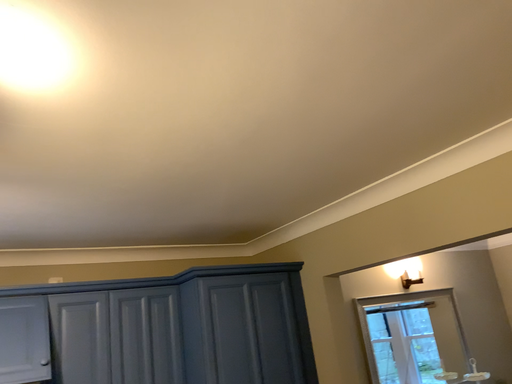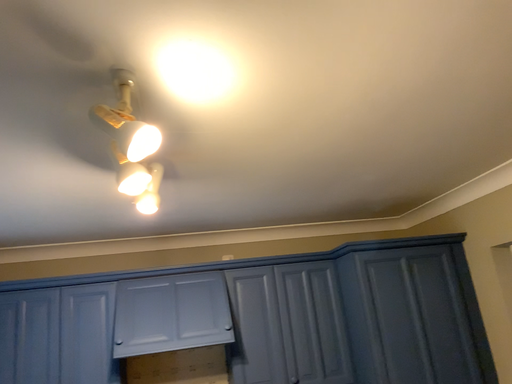
Question: Which way did the camera rotate in the video?

Choices:
 (A) rotated right
 (B) rotated left

Answer: (B)